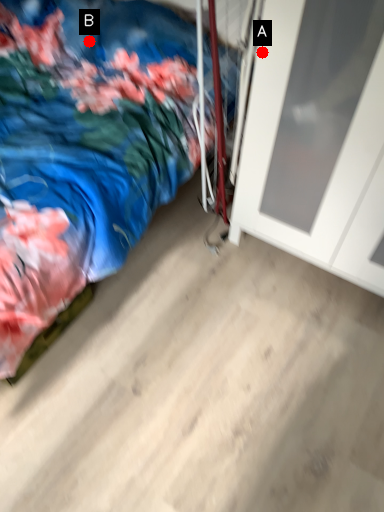
Question: Two points are circled on the image, labeled by A and B beside each circle. Among these points, which one is farthest from the camera?

Choices:
 (A) A is further
 (B) B is further

Answer: (B)